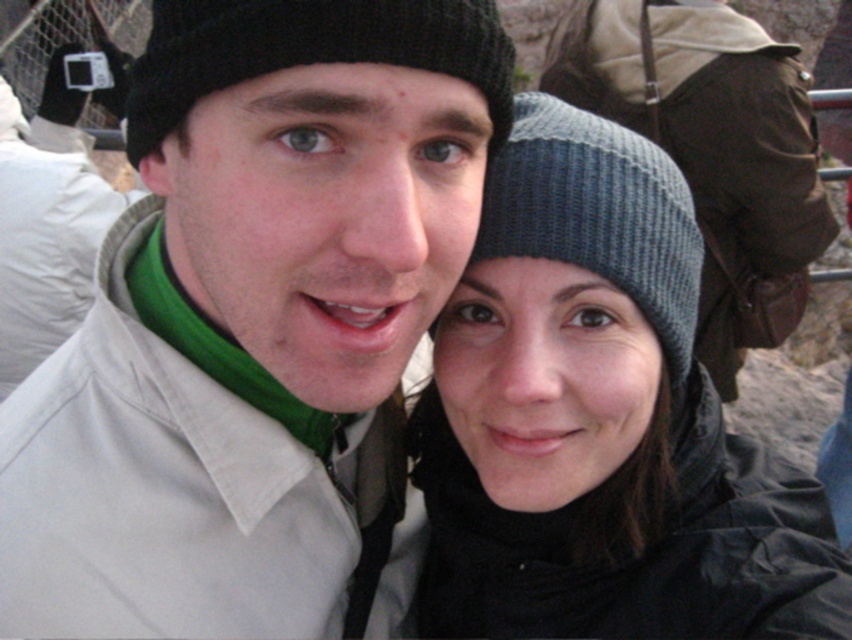
Which is more to the left, knitted wool beanie at center or gray knit beanie at upper center?

Positioned to the left is knitted wool beanie at center.

Can you confirm if knitted wool beanie at center is shorter than gray knit beanie at upper center?

Indeed, knitted wool beanie at center has a lesser height compared to gray knit beanie at upper center.

Who is more distant from viewer, (496, 563) or (770, 304)?

Positioned behind is point (770, 304).

Find the location of a particular element. The height and width of the screenshot is (640, 852). knitted wool beanie at center is located at coordinates (600, 422).

Which of these two, gray knit beanie at upper center or black knit hat at upper center, stands shorter?

With less height is black knit hat at upper center.

Is gray knit beanie at upper center to the right of black knit hat at upper center from the viewer's perspective?

Yes, gray knit beanie at upper center is to the right of black knit hat at upper center.

Who is more distant from viewer, (802, 68) or (174, 108)?

The point (802, 68) is behind.

At what (x,y) coordinates should I click in order to perform the action: click on gray knit beanie at upper center. Please return your answer as a coordinate pair (x, y). The height and width of the screenshot is (640, 852). Looking at the image, I should click on (712, 148).

Is knitted wool beanie at center below black knit hat at upper center?

Correct, knitted wool beanie at center is located below black knit hat at upper center.

Between knitted wool beanie at center and black knit hat at upper center, which one is positioned lower?

knitted wool beanie at center

The height and width of the screenshot is (640, 852). What do you see at coordinates (600, 422) in the screenshot? I see `knitted wool beanie at center` at bounding box center [600, 422].

The image size is (852, 640). I want to click on knitted wool beanie at center, so click(600, 422).